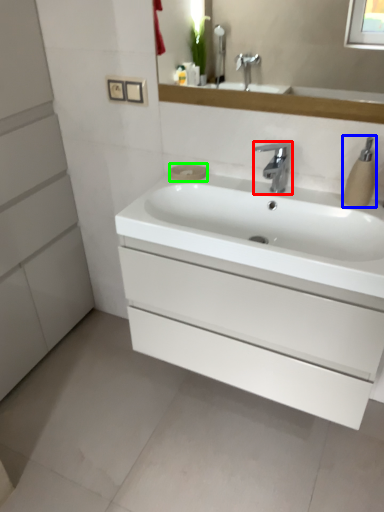
Question: Which object is the farthest from tap (highlighted by a red box)? Choose among these: soap dispenser (highlighted by a blue box) or soap (highlighted by a green box).

Choices:
 (A) soap dispenser
 (B) soap

Answer: (B)